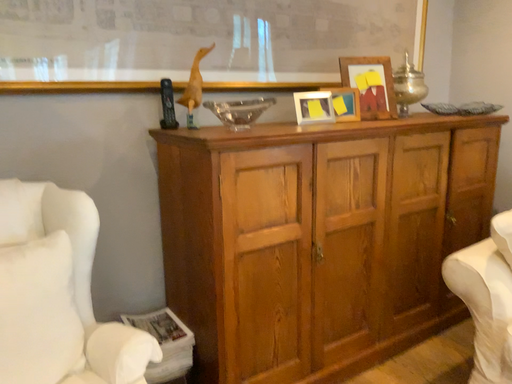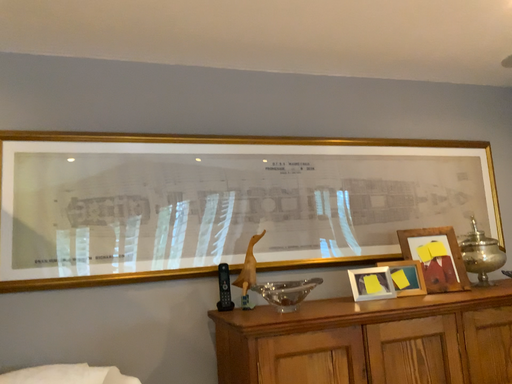
Question: Which way did the camera rotate in the video?

Choices:
 (A) rotated left
 (B) rotated right

Answer: (A)